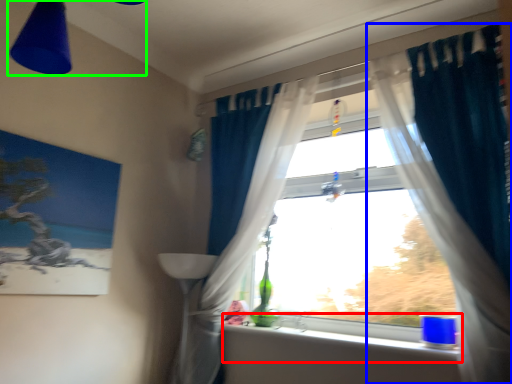
Question: Which object is the closest to the window sill (highlighted by a red box)? Choose among these: curtain (highlighted by a blue box) or light fixture (highlighted by a green box).

Choices:
 (A) curtain
 (B) light fixture

Answer: (A)